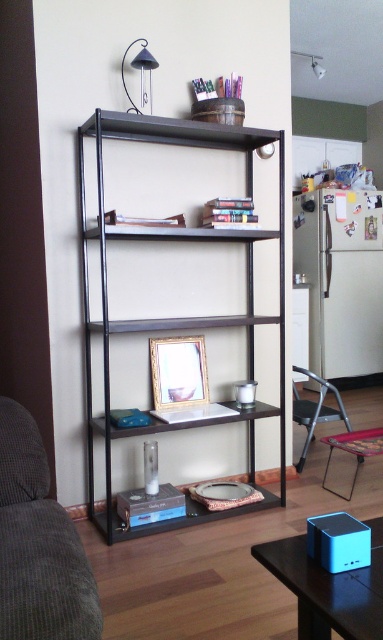
Question: Which object is closer to the camera taking this photo?

Choices:
 (A) metallic gray chair at lower right
 (B) black matte shelf at center
 (C) gray corduroy couch at lower left
 (D) gold metallic picture frame at center

Answer: (C)

Question: Estimate the real-world distances between objects in this image. Which object is closer to the gold metallic picture frame at center?

Choices:
 (A) black matte shelf at center
 (B) blue plastic speaker at lower right
 (C) gray corduroy couch at lower left
 (D) metallic folding table at lower right

Answer: (A)

Question: Is blue plastic speaker at lower right below gold metallic picture frame at center?

Choices:
 (A) yes
 (B) no

Answer: (A)

Question: Considering the relative positions of black matte shelf at center and metallic folding table at lower right in the image provided, where is black matte shelf at center located with respect to metallic folding table at lower right?

Choices:
 (A) below
 (B) above

Answer: (B)

Question: Is blue plastic speaker at lower right bigger than gold metallic picture frame at center?

Choices:
 (A) yes
 (B) no

Answer: (A)

Question: Which point is closer to the camera?

Choices:
 (A) 358,584
 (B) 198,364

Answer: (A)